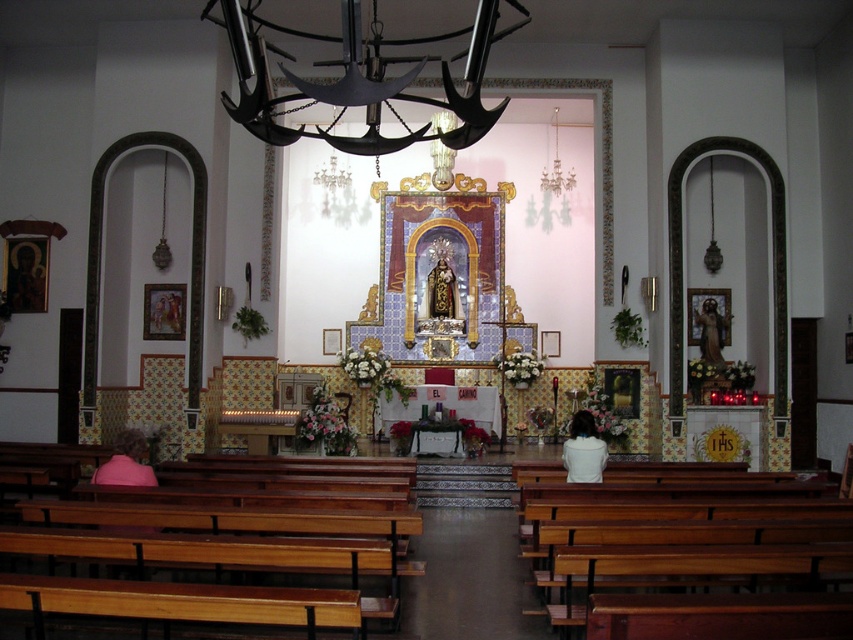
Question: Which point is closer to the camera taking this photo?

Choices:
 (A) (115, 477)
 (B) (575, 438)
 (C) (712, 301)

Answer: (A)

Question: From the image, what is the correct spatial relationship of white fabric at center in relation to wooden statue at right?

Choices:
 (A) right
 (B) left

Answer: (B)

Question: Observing the image, what is the correct spatial positioning of white fabric at center in reference to pink fabric at lower left?

Choices:
 (A) below
 (B) above

Answer: (A)

Question: Estimate the real-world distances between objects in this image. Which object is closer to the white fabric at center?

Choices:
 (A) pink fabric at lower left
 (B) wooden statue at right

Answer: (A)

Question: Is white fabric at center smaller than wooden statue at right?

Choices:
 (A) yes
 (B) no

Answer: (A)

Question: Which point is farther to the camera?

Choices:
 (A) (579, 456)
 (B) (115, 460)

Answer: (A)